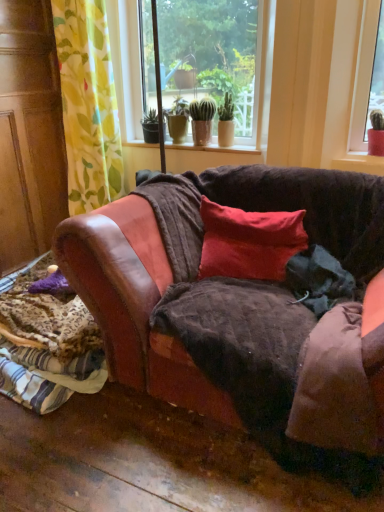
Question: From the image's perspective, is leather couch at lower left above yellow-green floral fabric at left?

Choices:
 (A) no
 (B) yes

Answer: (A)

Question: From a real-world perspective, is leather couch at lower left positioned over yellow-green floral fabric at left based on gravity?

Choices:
 (A) no
 (B) yes

Answer: (A)

Question: Does leather couch at lower left have a greater width compared to yellow-green floral fabric at left?

Choices:
 (A) no
 (B) yes

Answer: (B)

Question: Is leather couch at lower left placed right next to yellow-green floral fabric at left?

Choices:
 (A) yes
 (B) no

Answer: (B)

Question: Can you confirm if leather couch at lower left is shorter than yellow-green floral fabric at left?

Choices:
 (A) no
 (B) yes

Answer: (B)

Question: Is yellow-green floral fabric at left at the back of leather couch at lower left?

Choices:
 (A) no
 (B) yes

Answer: (A)

Question: Is matte ceramic pots at center looking in the opposite direction of brown leather couch at center?

Choices:
 (A) yes
 (B) no

Answer: (B)

Question: Is matte ceramic pots at center facing towards brown leather couch at center?

Choices:
 (A) yes
 (B) no

Answer: (B)

Question: Can you confirm if matte ceramic pots at center is thinner than brown leather couch at center?

Choices:
 (A) no
 (B) yes

Answer: (B)

Question: Is matte ceramic pots at center located outside brown leather couch at center?

Choices:
 (A) yes
 (B) no

Answer: (A)

Question: Does matte ceramic pots at center have a smaller size compared to brown leather couch at center?

Choices:
 (A) no
 (B) yes

Answer: (B)

Question: Can you confirm if matte ceramic pots at center is wider than brown leather couch at center?

Choices:
 (A) no
 (B) yes

Answer: (A)

Question: From a real-world perspective, does matte ceramic pots at center sit lower than yellow-green floral fabric at left?

Choices:
 (A) yes
 (B) no

Answer: (B)